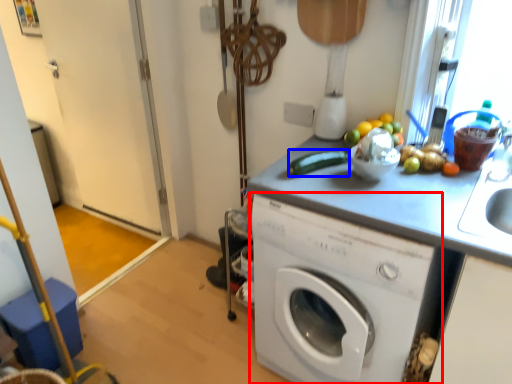
Question: Which object is closer to the camera taking this photo, washing machine (highlighted by a red box) or vegetable (highlighted by a blue box)?

Choices:
 (A) washing machine
 (B) vegetable

Answer: (A)